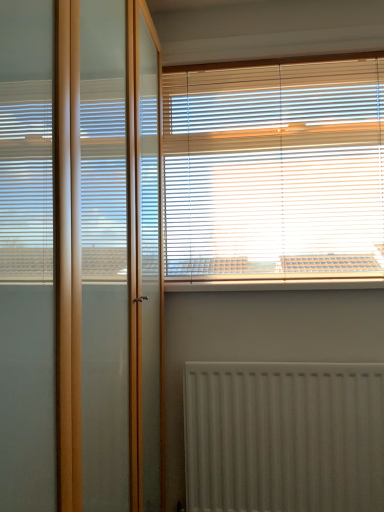
Question: Can transparent glass screen door at left be found inside white textured radiator at lower center?

Choices:
 (A) yes
 (B) no

Answer: (B)

Question: From a real-world perspective, does white textured radiator at lower center sit lower than transparent glass screen door at left?

Choices:
 (A) yes
 (B) no

Answer: (A)

Question: Is white textured radiator at lower center placed right next to transparent glass screen door at left?

Choices:
 (A) no
 (B) yes

Answer: (A)

Question: Does white textured radiator at lower center have a greater height compared to transparent glass screen door at left?

Choices:
 (A) yes
 (B) no

Answer: (B)

Question: Does white textured radiator at lower center lie behind transparent glass screen door at left?

Choices:
 (A) no
 (B) yes

Answer: (B)

Question: Looking at the image, does white plastic window sill at upper center seem bigger or smaller compared to white textured radiator at lower center?

Choices:
 (A) big
 (B) small

Answer: (B)

Question: Looking at their shapes, would you say white plastic window sill at upper center is wider or thinner than white textured radiator at lower center?

Choices:
 (A) thin
 (B) wide

Answer: (B)

Question: Is white plastic window sill at upper center to the left or to the right of white textured radiator at lower center in the image?

Choices:
 (A) left
 (B) right

Answer: (A)

Question: From a real-world perspective, is white plastic window sill at upper center positioned above or below white textured radiator at lower center?

Choices:
 (A) below
 (B) above

Answer: (B)

Question: Considering the positions of white textured radiator at lower center and white plastic window sill at upper center in the image, is white textured radiator at lower center bigger or smaller than white plastic window sill at upper center?

Choices:
 (A) big
 (B) small

Answer: (A)

Question: From a real-world perspective, relative to white plastic window sill at upper center, is white textured radiator at lower center vertically above or below?

Choices:
 (A) below
 (B) above

Answer: (A)

Question: In the image, is white textured radiator at lower center positioned in front of or behind white plastic window sill at upper center?

Choices:
 (A) behind
 (B) front

Answer: (B)

Question: From the image's perspective, is white textured radiator at lower center positioned above or below white plastic window sill at upper center?

Choices:
 (A) above
 (B) below

Answer: (B)

Question: Would you say white plastic window sill at upper center is inside or outside transparent glass screen door at left?

Choices:
 (A) inside
 (B) outside

Answer: (B)

Question: Is point coord(210,288) closer or farther from the camera than point coord(84,100)?

Choices:
 (A) closer
 (B) farther

Answer: (B)